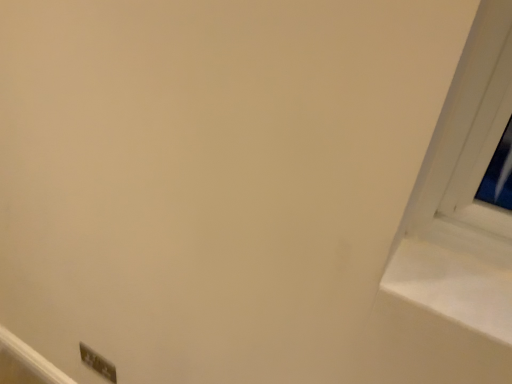
What is the approximate height of matte silver outlet at lower left?

matte silver outlet at lower left is 3.84 inches tall.

What do you see at coordinates (98, 363) in the screenshot? I see `matte silver outlet at lower left` at bounding box center [98, 363].

I want to click on matte silver outlet at lower left, so click(x=98, y=363).

In order to click on matte silver outlet at lower left in this screenshot , I will do `click(98, 363)`.